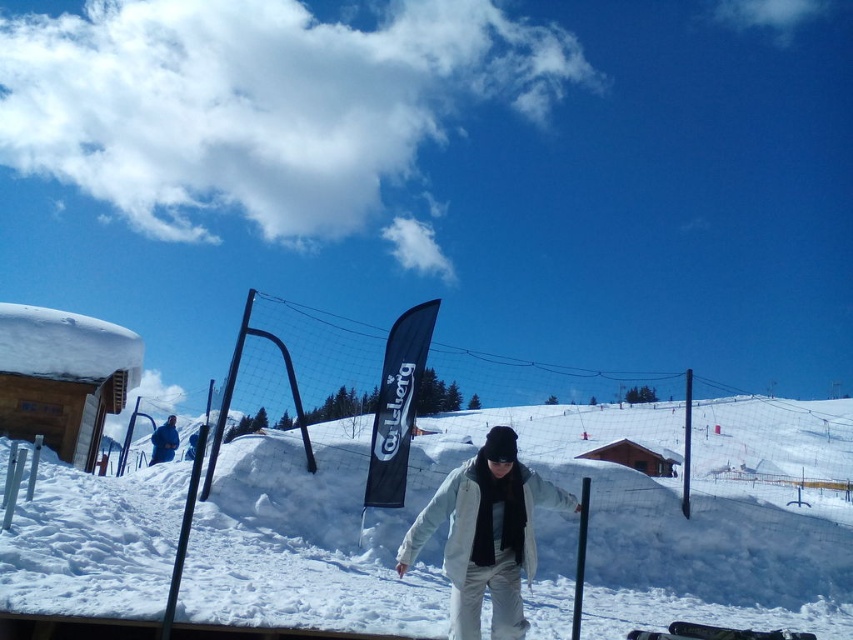
Is white fluffy snow at center further to the viewer compared to blue fabric jacket at lower left?

No, it is in front of blue fabric jacket at lower left.

Does point (177, 483) come behind point (155, 458)?

No, (177, 483) is closer to viewer.

What are the coordinates of `white fluffy snow at center` in the screenshot? It's located at (560, 484).